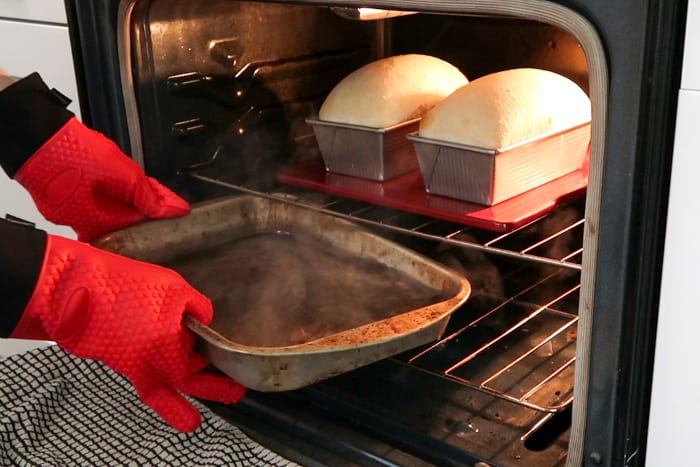
Find the location of a particular element. towel is located at coordinates (136, 446).